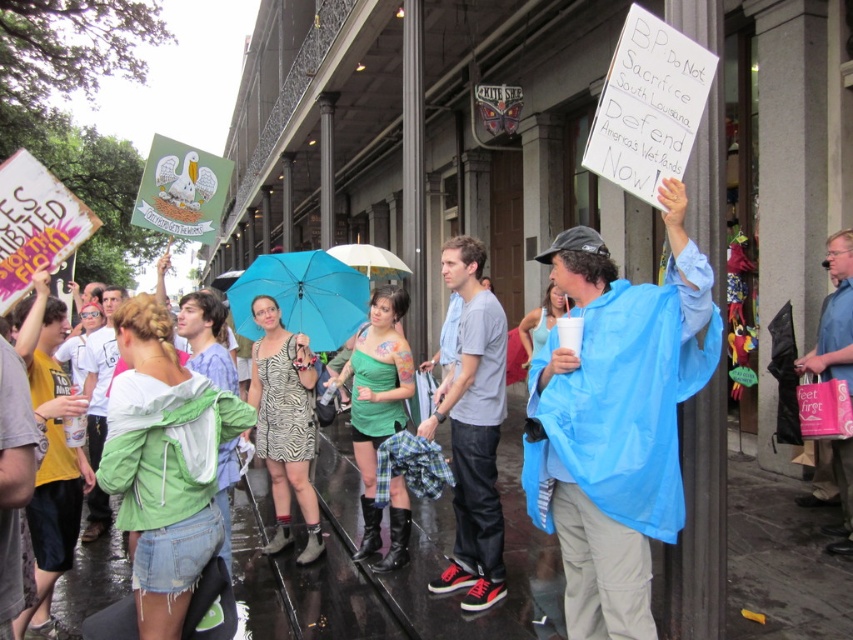
Question: Does blue fabric umbrella at center lie in front of white matte umbrella at center?

Choices:
 (A) no
 (B) yes

Answer: (B)

Question: Which object is farther from the camera taking this photo?

Choices:
 (A) green denim jacket at lower left
 (B) green matte dress at center
 (C) white matte umbrella at center
 (D) pink fabric bag at right

Answer: (C)

Question: Is the position of blue waterproof poncho at center less distant than that of white matte umbrella at center?

Choices:
 (A) no
 (B) yes

Answer: (B)

Question: Which point appears closest to the camera in this image?

Choices:
 (A) (207, 483)
 (B) (625, 300)
 (C) (270, 424)
 (D) (850, 524)

Answer: (B)

Question: Can you confirm if green denim jacket at lower left is positioned above zebra print dress at center?

Choices:
 (A) no
 (B) yes

Answer: (B)

Question: Which point is farther from the camera taking this photo?

Choices:
 (A) (260, 284)
 (B) (352, 250)
 (C) (833, 243)
 (D) (607, 275)

Answer: (B)